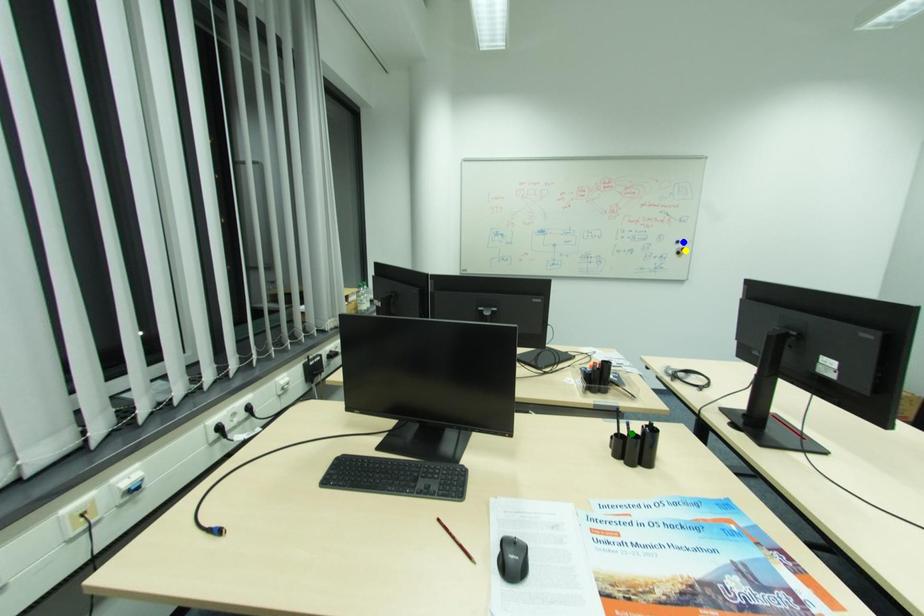
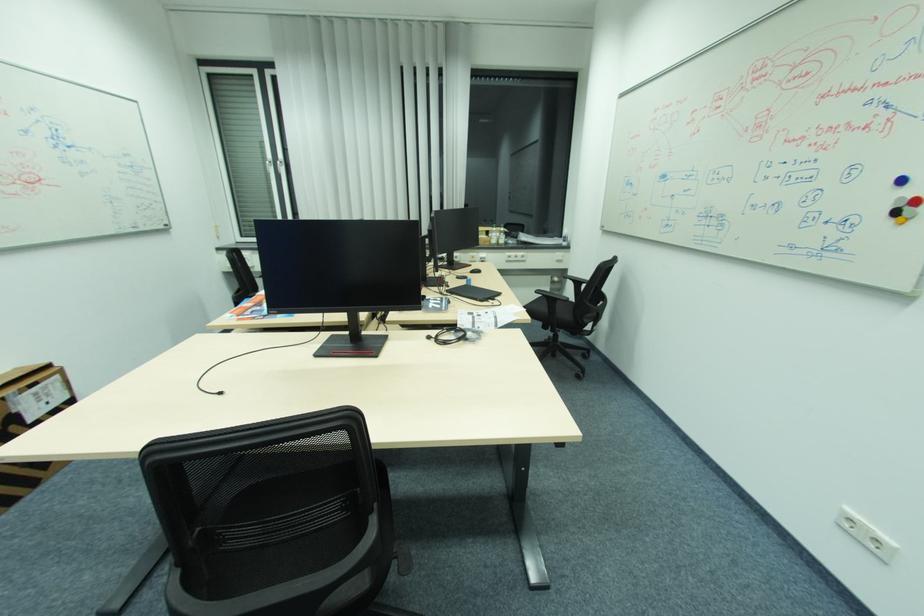
I am providing you with two images of the same scene from different viewpoints. Three points are marked in image1. Which point corresponds to a part or object that is occluded in image2?In image1, three points are marked. Which of them correspond to a part or object that is occluded in image2?Among the three points shown in image1, which one corresponds to a part or object that is no longer visible due to occlusion in image2?

green point